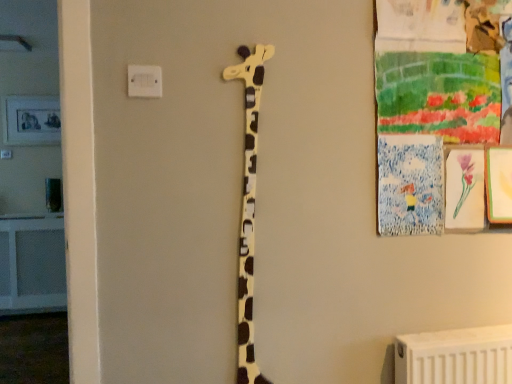
Question: Is matte yellow giraffe at center wider or thinner than white plastic electric outlet at upper center?

Choices:
 (A) wide
 (B) thin

Answer: (A)

Question: Looking at the image, does matte yellow giraffe at center seem bigger or smaller compared to white plastic electric outlet at upper center?

Choices:
 (A) big
 (B) small

Answer: (A)

Question: Considering the relative positions of matte yellow giraffe at center and white plastic electric outlet at upper center in the image provided, is matte yellow giraffe at center to the left or to the right of white plastic electric outlet at upper center?

Choices:
 (A) left
 (B) right

Answer: (B)

Question: From a real-world perspective, is white plastic electric outlet at upper center above or below matte yellow giraffe at center?

Choices:
 (A) below
 (B) above

Answer: (B)

Question: In the image, is white plastic electric outlet at upper center positioned in front of or behind matte yellow giraffe at center?

Choices:
 (A) front
 (B) behind

Answer: (A)

Question: In terms of width, does white plastic electric outlet at upper center look wider or thinner when compared to matte yellow giraffe at center?

Choices:
 (A) thin
 (B) wide

Answer: (A)

Question: From the image's perspective, relative to matte yellow giraffe at center, is white plastic electric outlet at upper center above or below?

Choices:
 (A) below
 (B) above

Answer: (B)